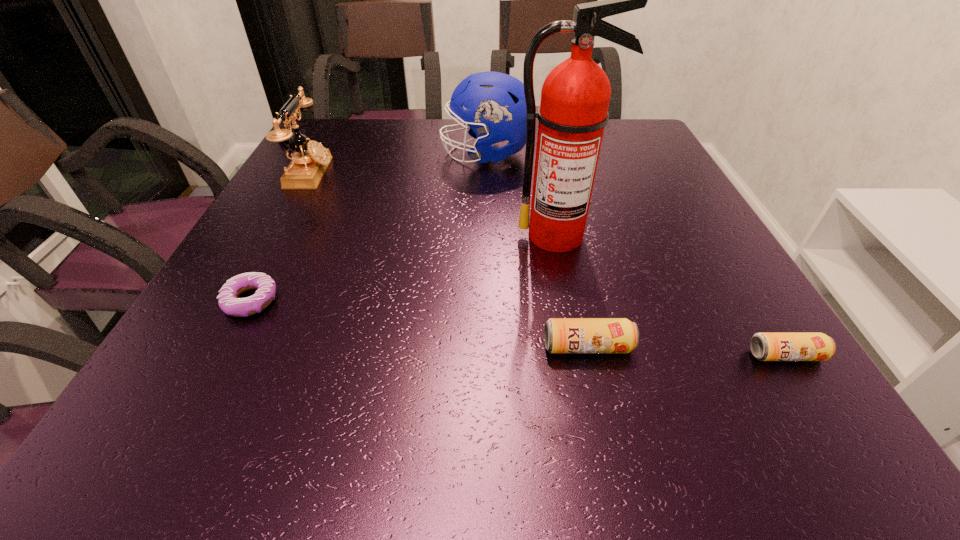
This screenshot has width=960, height=540. What are the coordinates of `telephone that is at the left edge` in the screenshot? It's located at (309, 162).

The width and height of the screenshot is (960, 540). In order to click on doughnut present at the left edge in this screenshot , I will do `click(228, 301)`.

Find the location of a particular element. object located at the right edge is located at coordinates (764, 346).

Where is `object that is positioned at the far left corner`? The height and width of the screenshot is (540, 960). object that is positioned at the far left corner is located at coordinates (309, 162).

Image resolution: width=960 pixels, height=540 pixels. Identify the location of object that is positioned at the near right corner. (764, 346).

Where is `blank space at the far edge`? This screenshot has width=960, height=540. blank space at the far edge is located at coordinates (374, 151).

I want to click on free spot at the left edge of the desktop, so click(266, 232).

In the image, there is a desktop. Identify the location of vacant space at the right edge. The height and width of the screenshot is (540, 960). (736, 296).

At what (x,y) coordinates should I click in order to perform the action: click on free space at the far left corner of the desktop. Please return your answer as a coordinate pair (x, y). This screenshot has width=960, height=540. Looking at the image, I should click on (343, 125).

In the image, there is a desktop. Where is `vacant space at the far right corner`? vacant space at the far right corner is located at coordinates (630, 118).